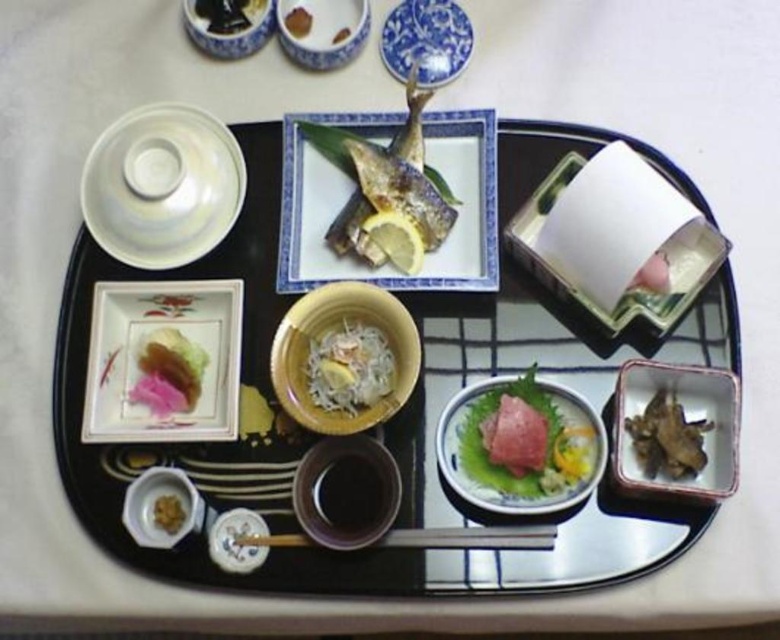
Is white glossy rice at center shorter than smooth brown rice at center?

No, white glossy rice at center is not shorter than smooth brown rice at center.

Between point (362, 371) and point (339, 35), which one is positioned in front?

Point (362, 371) is in front.

Between point (310, 339) and point (342, 29), which one is positioned behind?

Positioned behind is point (342, 29).

The image size is (780, 640). In order to click on white glossy rice at center in this screenshot , I will do `click(349, 368)`.

Who is shorter, pink glossy raw fish at center or brown matte rice at upper center?

Standing shorter between the two is brown matte rice at upper center.

Who is more forward, (520, 467) or (300, 16)?

Point (520, 467) is more forward.

Where is `pink glossy raw fish at center`? This screenshot has width=780, height=640. pink glossy raw fish at center is located at coordinates (520, 445).

Is porcelain plate with fish at center wider than brown matte rice at upper center?

Yes, porcelain plate with fish at center is wider than brown matte rice at upper center.

Which is behind, point (470, 132) or point (289, 22)?

The point (289, 22) is behind.

Find the location of `porcelain plate with fish at center`. porcelain plate with fish at center is located at coordinates (353, 188).